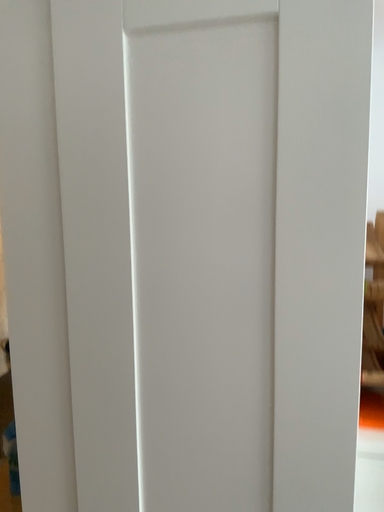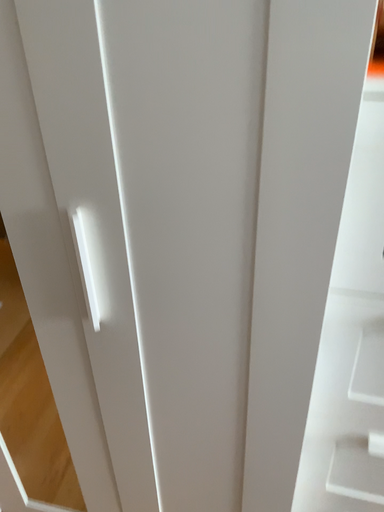
Question: Which way did the camera rotate in the video?

Choices:
 (A) rotated downward
 (B) rotated upward

Answer: (A)